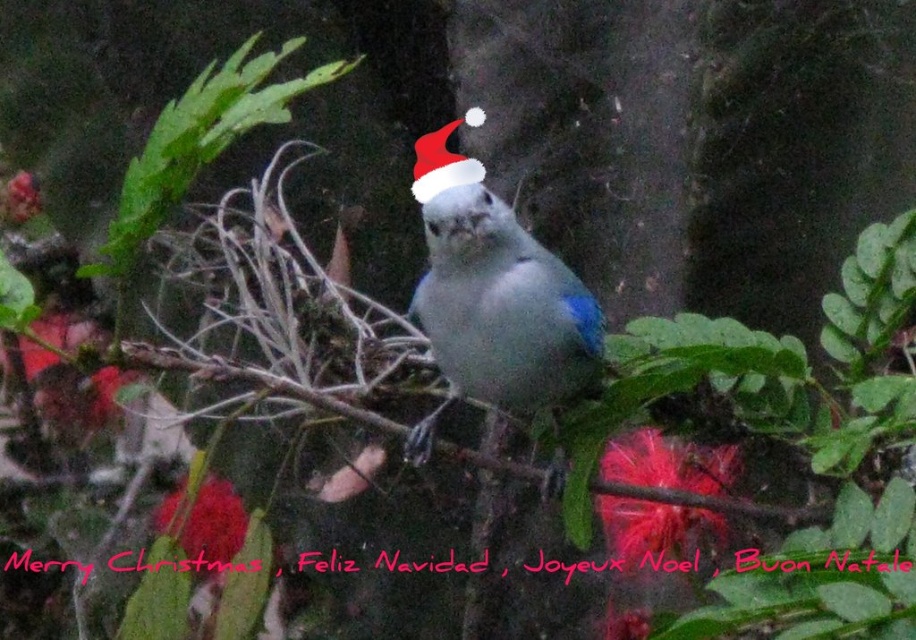
You are a photographer trying to capture the matte white bird at center and the white fabric santa hat at center in a single shot. Your camera has a minimum focus distance of 15 centimeters. Will you be able to focus on both objects simultaneously?

The matte white bird at center and the white fabric santa hat at center are 14.40 centimeters apart from each other. Since the minimum focus distance is 15 centimeters, the camera cannot focus on both objects at the same time because the distance between them is less than the required minimum focus distance.

You are an ornithologist observing a bird with a Santa hat in a green forest. You notice the matte white bird at center and the white fabric santa hat at center. Which object is positioned to the left?

The white fabric santa hat at center is positioned to the left of the matte white bird at center.